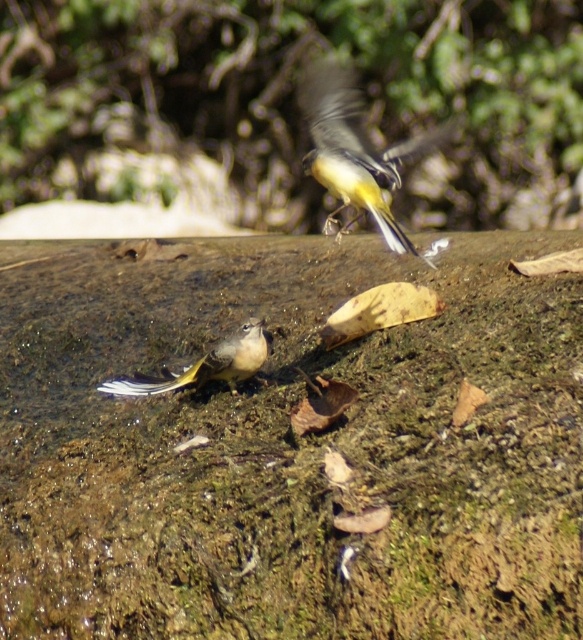
Is green leafy tree at upper center bigger than yellow-green feathers at center?

Yes, green leafy tree at upper center is bigger than yellow-green feathers at center.

Looking at this image, measure the distance from green leafy tree at upper center to yellow-green feathers at center.

The distance of green leafy tree at upper center from yellow-green feathers at center is 3.18 meters.

Between point (247, 131) and point (128, 385), which one is positioned in front?

Point (128, 385) is in front.

Locate an element on the screen. This screenshot has height=640, width=583. green leafy tree at upper center is located at coordinates (293, 92).

Can you confirm if yellow-green feathers bird at center is bigger than yellow-green feathers at center?

Correct, yellow-green feathers bird at center is larger in size than yellow-green feathers at center.

Does point (374, 173) come farther from viewer compared to point (117, 381)?

No, (374, 173) is closer to viewer.

Who is more forward, (388, 241) or (238, 356)?

Point (388, 241) is in front.

Where is `yellow-green feathers bird at center`? yellow-green feathers bird at center is located at coordinates (353, 148).

Who is positioned more to the left, green leafy tree at upper center or yellow-green feathers bird at center?

From the viewer's perspective, green leafy tree at upper center appears more on the left side.

Is point (503, 173) farther from camera compared to point (353, 196)?

Yes.

Find the location of a particular element. This screenshot has width=583, height=640. green leafy tree at upper center is located at coordinates (293, 92).